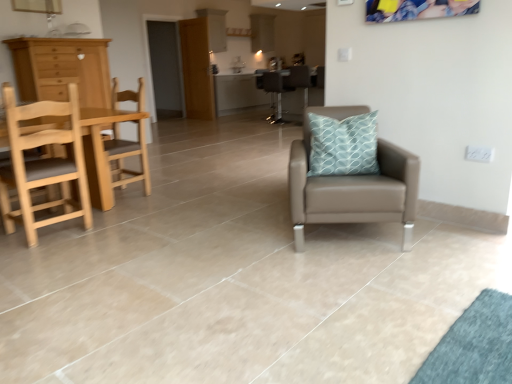
This screenshot has height=384, width=512. Identify the location of leather armchair at center, arranged as the first chair when viewed from the right. (300, 81).

Measure the distance between metallic silver table at center, acting as the 2th table starting from the front, and camera.

metallic silver table at center, acting as the 2th table starting from the front, and camera are 29.78 feet apart.

Image resolution: width=512 pixels, height=384 pixels. I want to click on brown leather armchair at center, so click(260, 78).

Could you tell me if light brown wooden chair at left, which appears as the first chair when viewed from the left, is turned towards leather armchair at center, arranged as the first chair when viewed from the right?

No.

Consider the image. How far apart are light brown wooden chair at left, the 5th chair in the right-to-left sequence, and leather armchair at center, which is counted as the second chair, starting from the back?

light brown wooden chair at left, the 5th chair in the right-to-left sequence, is 16.41 feet away from leather armchair at center, which is counted as the second chair, starting from the back.

Considering the positions of objects light brown wooden chair at left, which appears as the first chair when viewed from the left, and leather armchair at center, arranged as the first chair when viewed from the right, in the image provided, who is in front, light brown wooden chair at left, which appears as the first chair when viewed from the left, or leather armchair at center, arranged as the first chair when viewed from the right,?

light brown wooden chair at left, which appears as the first chair when viewed from the left.

Between light brown wooden chair at left, the 2th chair in the front-to-back sequence, and leather armchair at center, which is counted as the second chair, starting from the back, which one has less height?

Standing shorter between the two is light brown wooden chair at left, the 2th chair in the front-to-back sequence.

Based on the photo, is blue fabric couple at upper right positioned in front of wooden table at left, the second table viewed from the back?

No, it is behind wooden table at left, the second table viewed from the back.

Between blue fabric couple at upper right and wooden table at left, marked as the 1th table in a bottom-to-top arrangement, which one has more height?

wooden table at left, marked as the 1th table in a bottom-to-top arrangement, is taller.

Does blue fabric couple at upper right contain wooden table at left, the second table viewed from the back?

No, wooden table at left, the second table viewed from the back, is not a part of blue fabric couple at upper right.

Is blue fabric couple at upper right to the right of wooden table at left, which ranks as the 1th table in front-to-back order, from the viewer's perspective?

Correct, you'll find blue fabric couple at upper right to the right of wooden table at left, which ranks as the 1th table in front-to-back order.

Is light brown wooden chair at left, marked as the 4th chair in a back-to-front arrangement, not close to wooden table at left, the second table viewed from the back?

No, light brown wooden chair at left, marked as the 4th chair in a back-to-front arrangement, is not far from wooden table at left, the second table viewed from the back.

From the image's perspective, which one is positioned lower, light brown wooden chair at left, marked as the 4th chair in a back-to-front arrangement, or wooden table at left, the second table positioned from the top?

wooden table at left, the second table positioned from the top.

What's the angular difference between light brown wooden chair at left, the 2th chair in the front-to-back sequence, and wooden table at left, the second table viewed from the back,'s facing directions?

The angular difference between light brown wooden chair at left, the 2th chair in the front-to-back sequence, and wooden table at left, the second table viewed from the back, is 179 degrees.

Is light brown wooden chair at left, the 2th chair in the front-to-back sequence, oriented away from wooden table at left, the second table viewed from the back?

Yes, light brown wooden chair at left, the 2th chair in the front-to-back sequence,'s orientation is away from wooden table at left, the second table viewed from the back.

Considering the relative positions of leather armchair at center, which is counted as the 4th chair, starting from the front, and blue fabric couple at upper right in the image provided, is leather armchair at center, which is counted as the 4th chair, starting from the front, to the left of blue fabric couple at upper right from the viewer's perspective?

Yes.

How much distance is there between leather armchair at center, which is counted as the second chair, starting from the back, and blue fabric couple at upper right?

14.88 feet.

Considering the positions of objects leather armchair at center, arranged as the first chair when viewed from the right, and blue fabric couple at upper right in the image provided, who is in front, leather armchair at center, arranged as the first chair when viewed from the right, or blue fabric couple at upper right?

Positioned in front is blue fabric couple at upper right.

Between leather armchair at center, the 5th chair positioned from the left, and blue fabric couple at upper right, which one has larger width?

leather armchair at center, the 5th chair positioned from the left.

Choose the correct answer: Is light brown wooden chair at left, which appears as the first chair when viewed from the left, inside light brown wooden chair at left, the 3th chair in the front-to-back sequence, or outside it?

light brown wooden chair at left, which appears as the first chair when viewed from the left, is spatially situated outside light brown wooden chair at left, the 3th chair in the front-to-back sequence.

Considering the positions of objects light brown wooden chair at left, the 5th chair in the right-to-left sequence, and light brown wooden chair at left, which is counted as the third chair, starting from the back, in the image provided, who is behind, light brown wooden chair at left, the 5th chair in the right-to-left sequence, or light brown wooden chair at left, which is counted as the third chair, starting from the back,?

light brown wooden chair at left, which is counted as the third chair, starting from the back, is further away from the camera.

Is light brown wooden chair at left, marked as the 4th chair in a back-to-front arrangement, oriented away from light brown wooden chair at left, the 3th chair in the front-to-back sequence?

No, light brown wooden chair at left, marked as the 4th chair in a back-to-front arrangement,'s orientation is not away from light brown wooden chair at left, the 3th chair in the front-to-back sequence.

Who is shorter, light brown wooden chair at left, which appears as the first chair when viewed from the left, or light brown wooden chair at left, arranged as the 2th chair when viewed from the left?

With less height is light brown wooden chair at left, arranged as the 2th chair when viewed from the left.

Measure the distance from metallic silver stool at center, the third chair from the right, to wooden table at left, marked as the 1th table in a bottom-to-top arrangement.

15.39 feet.

From the image's perspective, is metallic silver stool at center, the third chair from the right, located above wooden table at left, the second table positioned from the top?

Correct, metallic silver stool at center, the third chair from the right, appears higher than wooden table at left, the second table positioned from the top, in the image.

Based on the photo, is the position of metallic silver stool at center, which is the 5th chair in front-to-back order, less distant than that of wooden table at left, which ranks as the 1th table in front-to-back order?

No, the depth of metallic silver stool at center, which is the 5th chair in front-to-back order, is greater than that of wooden table at left, which ranks as the 1th table in front-to-back order.

Is metallic silver stool at center, the first chair in the back-to-front sequence, to the left of wooden table at left, the second table viewed from the back, from the viewer's perspective?

Incorrect, metallic silver stool at center, the first chair in the back-to-front sequence, is not on the left side of wooden table at left, the second table viewed from the back.

From a real-world perspective, is brown leather armchair at center positioned above or below transparent glass door at center?

brown leather armchair at center is situated lower than transparent glass door at center in the real world.

Is brown leather armchair at center inside or outside of transparent glass door at center?

brown leather armchair at center cannot be found inside transparent glass door at center.

Between point (272, 102) and point (157, 95), which one is positioned behind?

The point (157, 95) is behind.

Is brown leather armchair at center next to transparent glass door at center and touching it?

No, brown leather armchair at center is not in contact with transparent glass door at center.

Starting from the light brown wooden chair at left, the 2th chair in the front-to-back sequence, which chair is the 4th one to the right? Please provide its 2D coordinates.

[(300, 81)]

At what (x,y) coordinates should I click in order to perform the action: click on table below the blue fabric couple at upper right (from the image's perspective). Please return your answer as a coordinate pair (x, y). The height and width of the screenshot is (384, 512). Looking at the image, I should click on (101, 151).

Which object lies nearer to the anchor point light blue textured cushion at center, leather armchair at center, which is counted as the second chair, starting from the back, or brown leather armchair at center?

The object closer to light blue textured cushion at center is leather armchair at center, which is counted as the second chair, starting from the back.

Considering their positions, is metallic silver table at center, positioned as the 2th table in bottom-to-top order, positioned closer to metallic silver stool at center, the third chair from the right, than brown leather armchair at center?

brown leather armchair at center is closer to metallic silver stool at center, the third chair from the right.

Based on their spatial positions, is light brown wooden chair at left, which appears as the first chair when viewed from the left, or leather armchair at center, which is counted as the second chair, starting from the back, further from transparent glass door at center?

light brown wooden chair at left, which appears as the first chair when viewed from the left, is further to transparent glass door at center.

Which object lies nearer to the anchor point transparent glass door at center, blue fabric couple at upper right or brown leather armchair at center?

The object closer to transparent glass door at center is brown leather armchair at center.

Based on the photo, which object lies nearer to the anchor point light wood/woodenobject at left, brown leather armchair at center or metallic silver stool at center, the third chair from the right?

The object closer to light wood/woodenobject at left is metallic silver stool at center, the third chair from the right.

Looking at the image, which one is located closer to light brown wooden chair at left, which is counted as the third chair, starting from the back, wooden table at left, marked as the 1th table in a bottom-to-top arrangement, or light brown wooden chair at left, marked as the 4th chair in a back-to-front arrangement?

wooden table at left, marked as the 1th table in a bottom-to-top arrangement, is positioned closer to the anchor light brown wooden chair at left, which is counted as the third chair, starting from the back.

Estimate the real-world distances between objects in this image. Which object is closer to metallic silver stool at center, the third chair from the right, light brown wooden chair at left, arranged as the fourth chair when viewed from the right, or light brown wooden chair at left, the 2th chair in the front-to-back sequence?

light brown wooden chair at left, arranged as the fourth chair when viewed from the right, lies closer to metallic silver stool at center, the third chair from the right, than the other object.

Which object lies nearer to the anchor point blue fabric couple at upper right, light brown wooden chair at left, the 2th chair in the front-to-back sequence, or brown leather armchair at center?

light brown wooden chair at left, the 2th chair in the front-to-back sequence, is closer to blue fabric couple at upper right.

The height and width of the screenshot is (384, 512). In order to click on glass door positioned between light brown wooden chair at left, the 5th chair in the right-to-left sequence, and metallic silver table at center, the first table viewed from the back, from near to far in this screenshot , I will do `click(165, 68)`.

This screenshot has height=384, width=512. I want to click on chair between light blue textured cushion at center and leather armchair at center, which is counted as the second chair, starting from the back, in the front-back direction, so click(128, 156).

Find the location of a particular element. This screenshot has height=384, width=512. cabinetry positioned between leather armchair at center, placed as the 2th chair when sorted from right to left, and brown leather armchair at center from near to far is located at coordinates (62, 69).

Where is `cabinetry between leather armchair at center, which is the first chair in front-to-back order, and leather armchair at center, which is counted as the second chair, starting from the back, from front to back`? cabinetry between leather armchair at center, which is the first chair in front-to-back order, and leather armchair at center, which is counted as the second chair, starting from the back, from front to back is located at coordinates (62, 69).